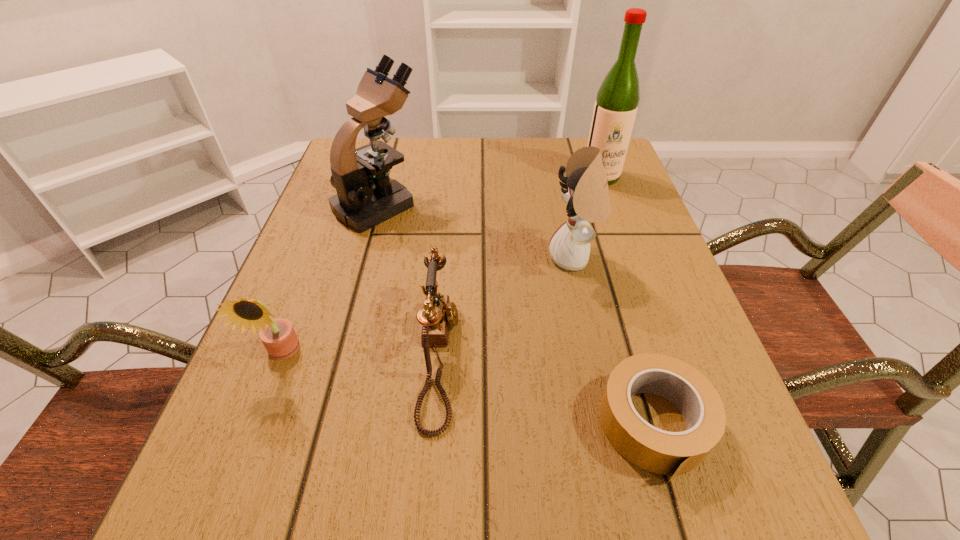
Find the location of a particular element. the tallest object is located at coordinates (616, 105).

This screenshot has height=540, width=960. In order to click on the fifth shortest object in this screenshot , I will do `click(366, 196)`.

Locate an element on the screen. This screenshot has width=960, height=540. the third tallest object is located at coordinates (586, 193).

Where is `sunflower`? The image size is (960, 540). sunflower is located at coordinates (278, 335).

Image resolution: width=960 pixels, height=540 pixels. Find the location of `the third object from left to right`. the third object from left to right is located at coordinates (438, 313).

Find the location of a particular element. the second shortest object is located at coordinates (438, 313).

Image resolution: width=960 pixels, height=540 pixels. Find the location of `duct tape`. duct tape is located at coordinates (662, 452).

Where is `vacant space located 0.120m on the label of the liquor`? Image resolution: width=960 pixels, height=540 pixels. vacant space located 0.120m on the label of the liquor is located at coordinates (615, 217).

At what (x,y) coordinates should I click in order to perform the action: click on vacant area situated 0.150m on the back of the microscope. Please return your answer as a coordinate pair (x, y). This screenshot has width=960, height=540. Looking at the image, I should click on (394, 150).

Locate an element on the screen. This screenshot has width=960, height=540. vacant space located 0.060m at the front face of the third tallest object is located at coordinates (518, 258).